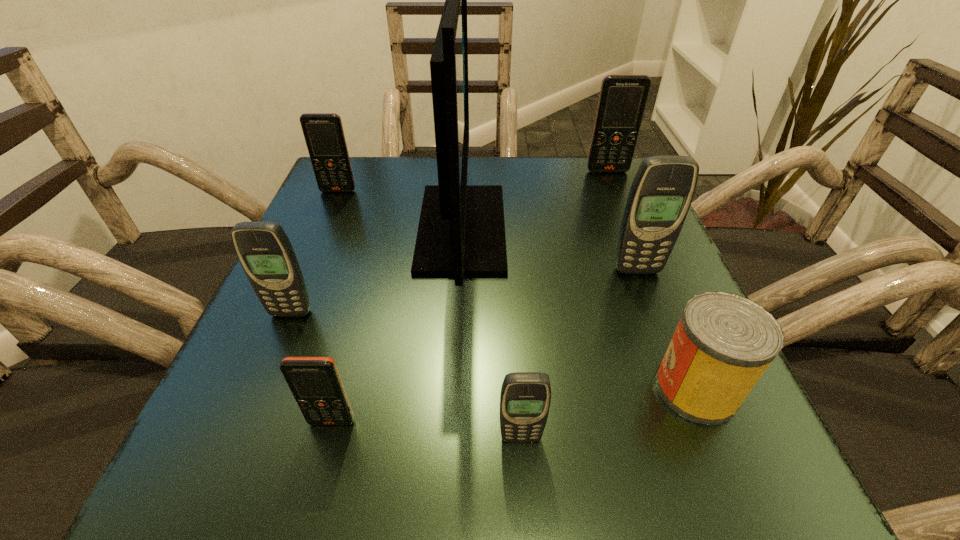
Identify the location of free region located 0.300m on the left of the can. (444, 388).

The width and height of the screenshot is (960, 540). Identify the location of monitor that is at the far edge. (461, 232).

You are a GUI agent. You are given a task and a screenshot of the screen. Output one action in this format:
    pyautogui.click(x=<x>, y=<y>)
    Task: Click on the object present at the near edge
    The width and height of the screenshot is (960, 540).
    Given the screenshot: What is the action you would take?
    tap(525, 398)

The width and height of the screenshot is (960, 540). I want to click on can that is at the right edge, so click(724, 342).

Where is `object positioned at the far left corner`? Image resolution: width=960 pixels, height=540 pixels. object positioned at the far left corner is located at coordinates (323, 132).

You are a GUI agent. You are given a task and a screenshot of the screen. Output one action in this format:
    pyautogui.click(x=<x>, y=<y>)
    Task: Click on the object that is at the far right corner
    The image size is (960, 540).
    Given the screenshot: What is the action you would take?
    pyautogui.click(x=622, y=100)

In the image, there is a desktop. Identify the location of blank space at the far edge. (423, 159).

In the image, there is a desktop. Where is `blank space at the near edge`? This screenshot has width=960, height=540. blank space at the near edge is located at coordinates (468, 453).

Where is `vacant space at the left edge of the desktop`? The image size is (960, 540). vacant space at the left edge of the desktop is located at coordinates (360, 271).

This screenshot has width=960, height=540. What are the coordinates of `blank space at the right edge of the desktop` in the screenshot? It's located at (593, 251).